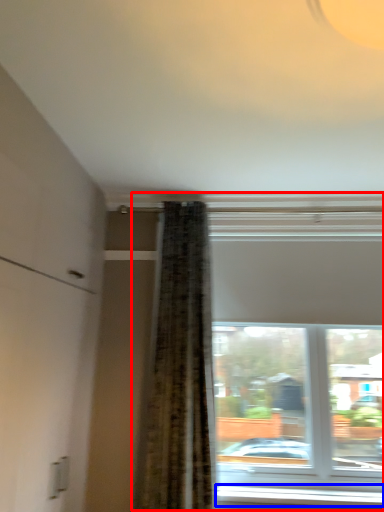
Question: Which object appears closest to the camera in this image, window (highlighted by a red box) or window sill (highlighted by a blue box)?

Choices:
 (A) window
 (B) window sill

Answer: (A)